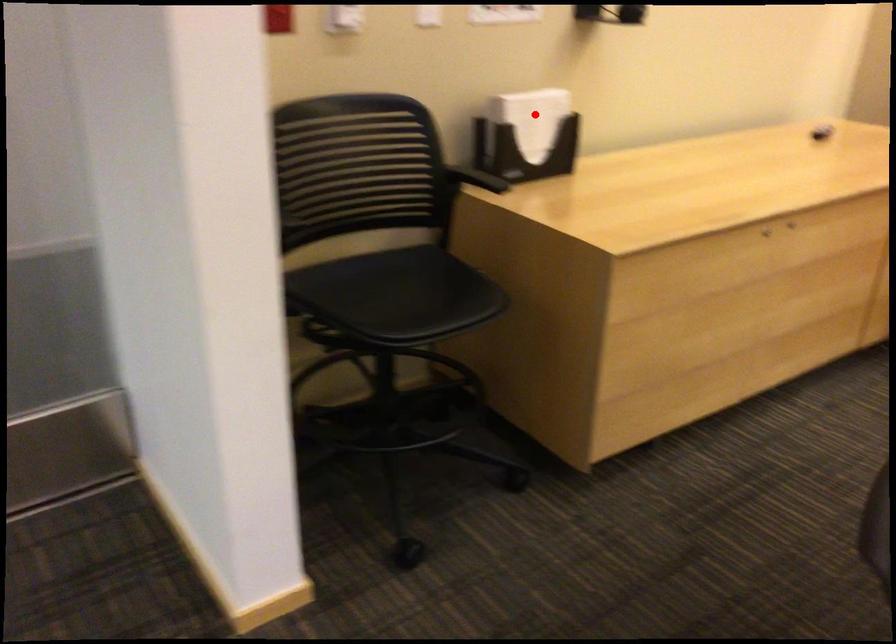
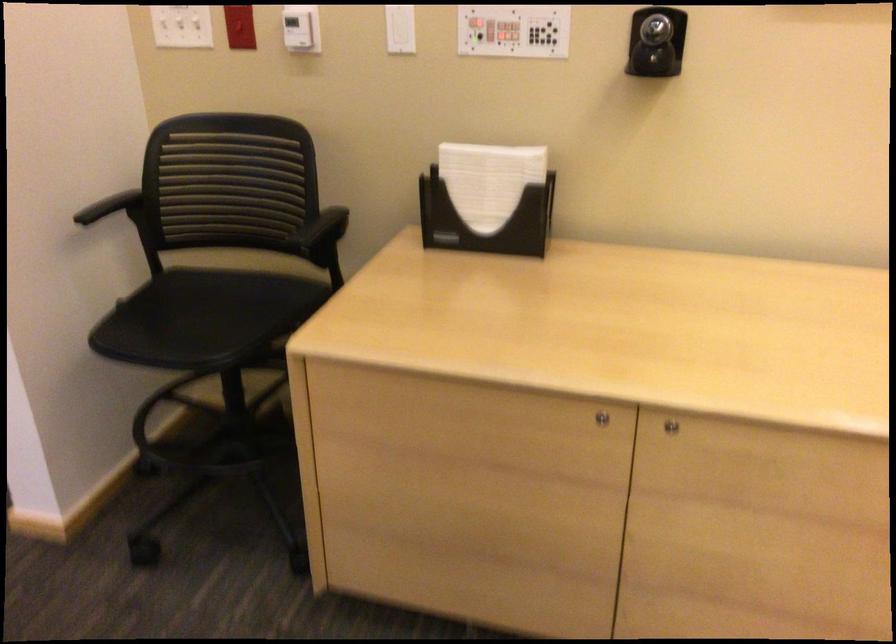
Where in the second image is the point corresponding to the highlighted location from the first image?

(488, 180)